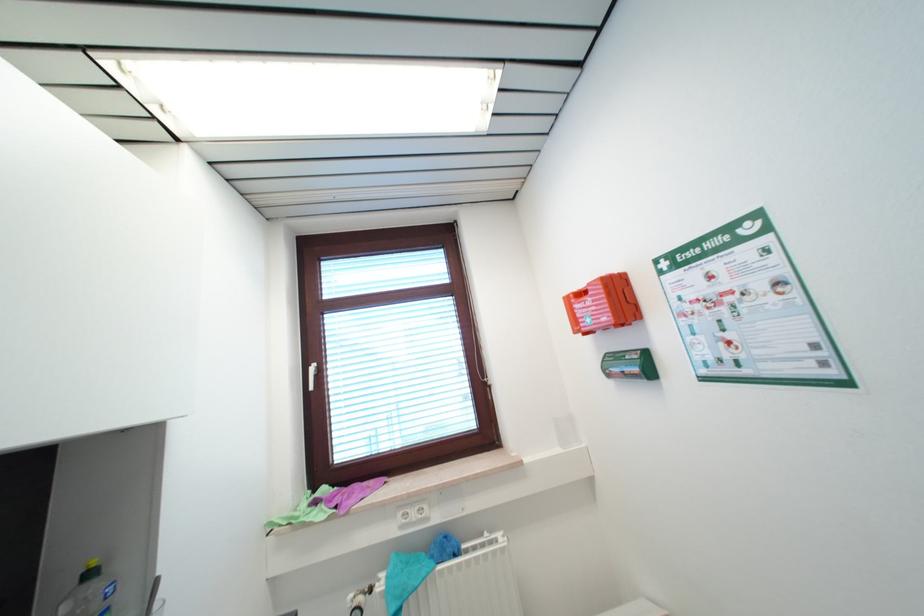
Which object does [347,495] point to?

It refers to a purple cloth.